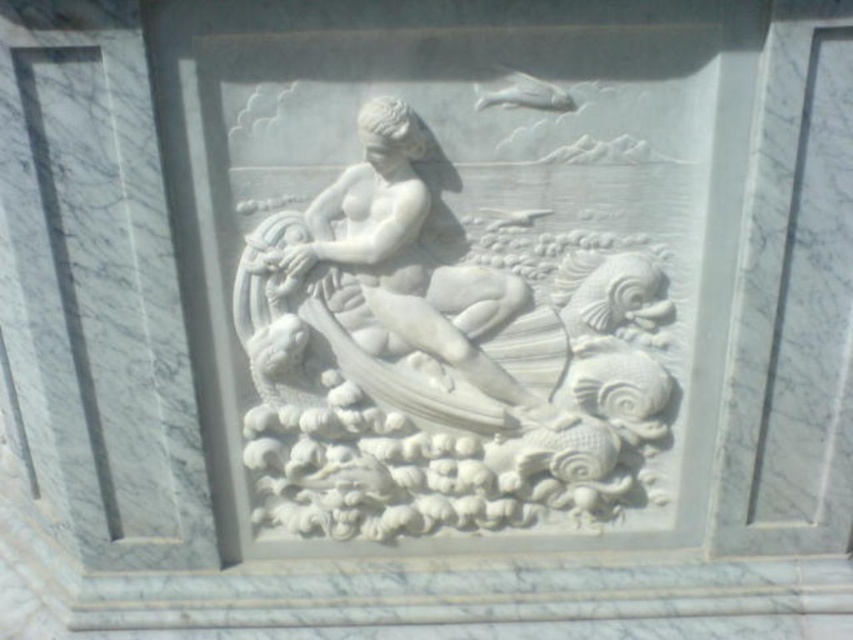
You are an art conservator examining the marble relief sculpture. You notice two central figures, the white marble mermaid at center and the white marble statue at center. Which one is positioned to the right of the other?

The white marble mermaid at center is to the right of the white marble statue at center.

You are an art conservator examining the marble relief sculpture. You need to determine which of the two central figures, the white marble mermaid at center or the white marble statue at center, requires more space for restoration. Based on their sizes, which one should you prioritize?

The white marble mermaid at center has a larger width than the white marble statue at center, so it requires more space for restoration and should be prioritized.

You are an art conservator examining the marble relief sculpture. You notice a point at coordinates [442,355]. What does this point correspond to in the relief?

The point at coordinates [442,355] corresponds to the white marble mermaid at center.